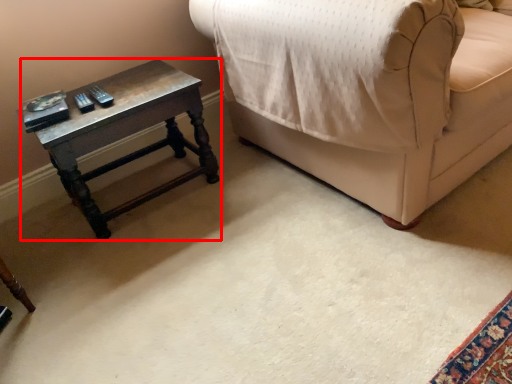
Question: Considering the relative positions of table (annotated by the red box) and furniture in the image provided, where is table (annotated by the red box) located with respect to the staircase?

Choices:
 (A) right
 (B) left

Answer: (B)